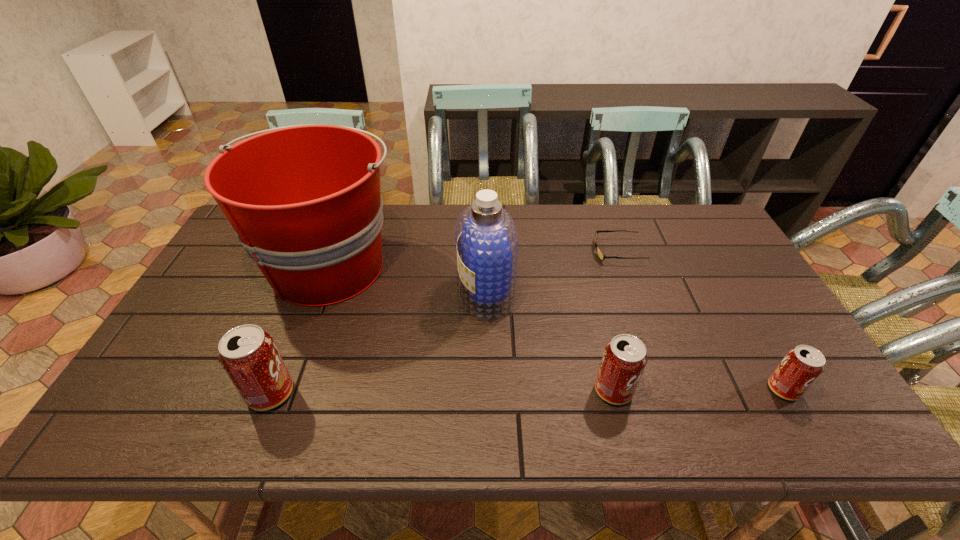
The height and width of the screenshot is (540, 960). In order to click on object present at the left edge in this screenshot , I will do `click(304, 200)`.

This screenshot has height=540, width=960. Identify the location of object present at the right edge. (801, 366).

This screenshot has height=540, width=960. Find the location of `object that is at the far left corner`. object that is at the far left corner is located at coordinates (304, 200).

The image size is (960, 540). Find the location of `object at the near right corner`. object at the near right corner is located at coordinates (801, 366).

What are the coordinates of `vacant space at the far edge` in the screenshot? It's located at (570, 240).

You are a GUI agent. You are given a task and a screenshot of the screen. Output one action in this format:
    pyautogui.click(x=<x>, y=<y>)
    Task: Click on the free space at the near edge of the desktop
    
    Given the screenshot: What is the action you would take?
    pyautogui.click(x=735, y=395)

In the image, there is a desktop. Identify the location of free region at the right edge. This screenshot has height=540, width=960. (708, 258).

Locate an element on the screen. vacant region at the far right corner of the desktop is located at coordinates click(716, 222).

Where is `vacant area that lies between the third object from right to left and the fourth object from right to left`? Image resolution: width=960 pixels, height=540 pixels. vacant area that lies between the third object from right to left and the fourth object from right to left is located at coordinates (549, 342).

In order to click on free space that is in between the bucket and the cleansing agent in this screenshot , I will do (408, 280).